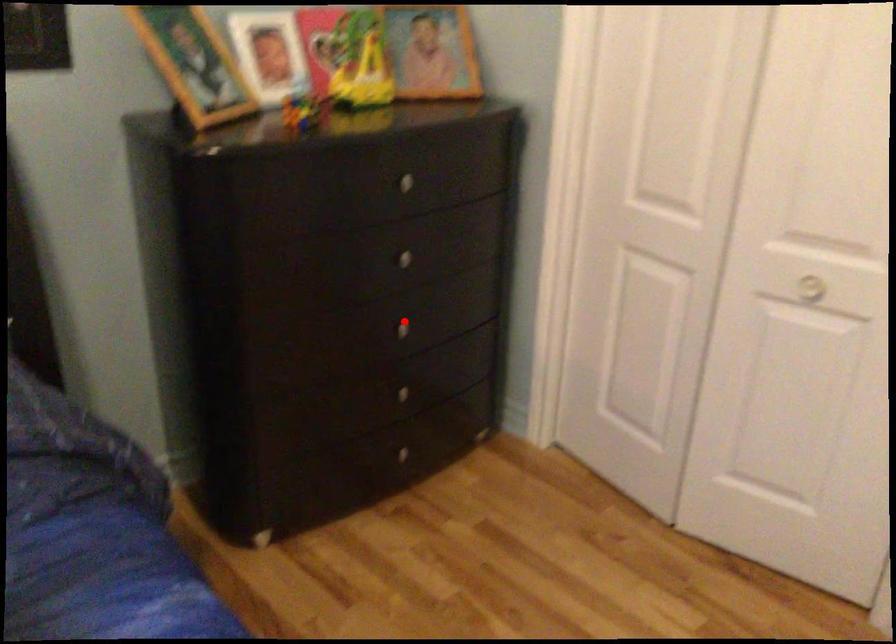
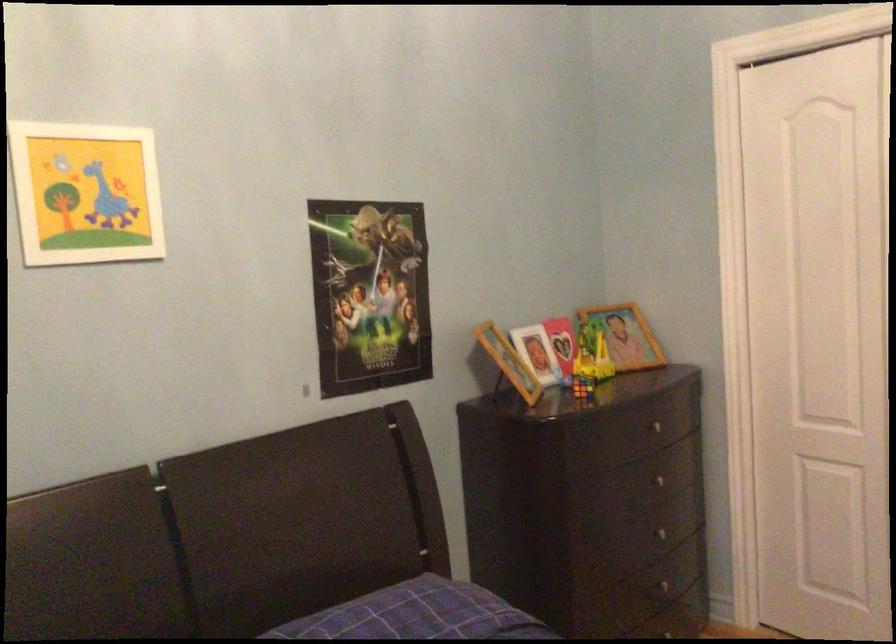
In the second image, find the point that corresponds to the highlighted location in the first image.

(667, 532)